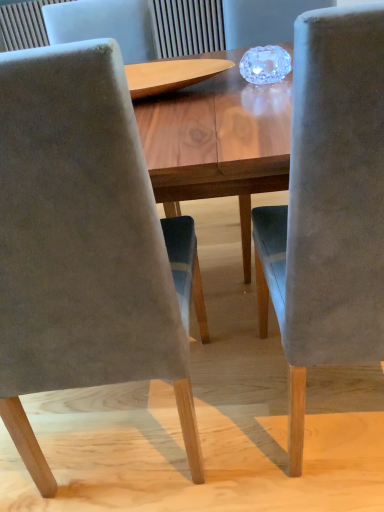
Find the location of a particular element. The width and height of the screenshot is (384, 512). free spot to the right of velvet gray chair at center, the 1th chair positioned from the left is located at coordinates (237, 397).